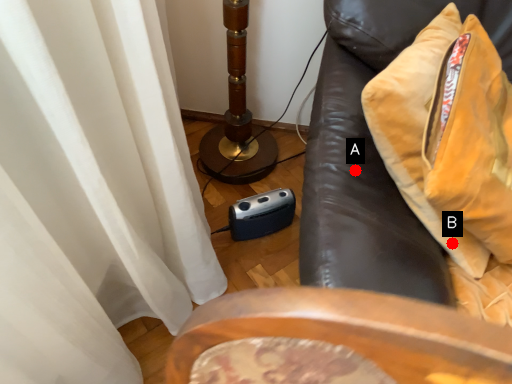
Question: Two points are circled on the image, labeled by A and B beside each circle. Which of the following is the farthest from the observer?

Choices:
 (A) A is further
 (B) B is further

Answer: (A)